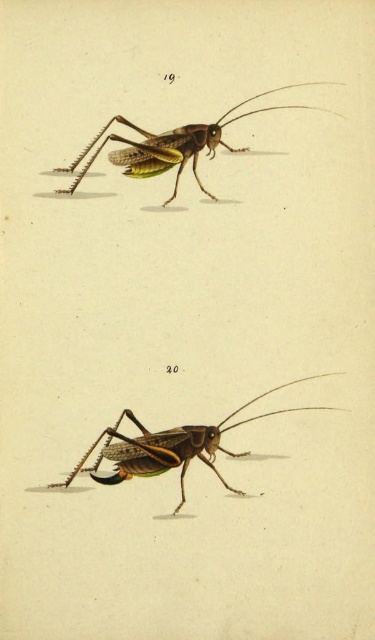
Does shiny green exoskeleton at bottom center have a smaller size compared to shiny green grasshopper at upper center?

No.

Is shiny green exoskeleton at bottom center bigger than shiny green grasshopper at upper center?

Yes, shiny green exoskeleton at bottom center is bigger than shiny green grasshopper at upper center.

At what (x,y) coordinates should I click in order to perform the action: click on shiny green exoskeleton at bottom center. Please return your answer as a coordinate pair (x, y). Looking at the image, I should click on (169, 445).